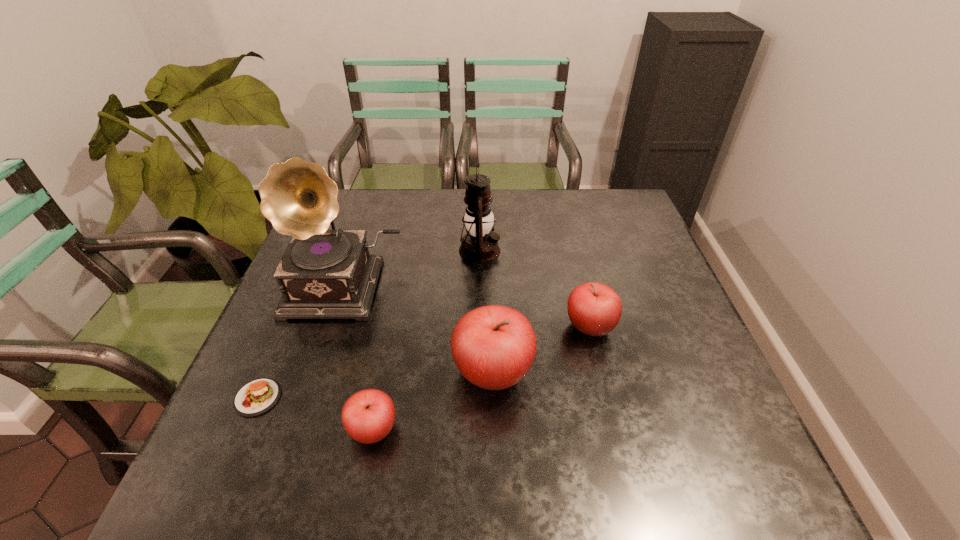
Identify the location of vacant space at the near edge. The width and height of the screenshot is (960, 540). (456, 407).

Where is `free space at the left edge of the desktop`? free space at the left edge of the desktop is located at coordinates (334, 320).

Identify the location of vacant point at the right edge. (617, 236).

This screenshot has width=960, height=540. In order to click on vacant region at the far left corner of the desktop in this screenshot , I will do `click(342, 207)`.

Where is `free point between the tallest object and the shortest apple`? free point between the tallest object and the shortest apple is located at coordinates (359, 359).

The image size is (960, 540). What are the coordinates of `free space between the shortest object and the tallest object` in the screenshot? It's located at (301, 342).

You are a GUI agent. You are given a task and a screenshot of the screen. Output one action in this format:
    pyautogui.click(x=<x>, y=<y>)
    Task: Click on the vacant area that lies between the shortest object and the rightmost apple
    The width and height of the screenshot is (960, 540).
    Given the screenshot: What is the action you would take?
    pyautogui.click(x=423, y=362)

Where is `free space between the lantern and the second shortest object`? Image resolution: width=960 pixels, height=540 pixels. free space between the lantern and the second shortest object is located at coordinates (426, 341).

Where is `vacant area that lies between the second apple from right to left and the record player`? The width and height of the screenshot is (960, 540). vacant area that lies between the second apple from right to left and the record player is located at coordinates (419, 330).

Where is `free point between the second apple from right to left and the record player`? The image size is (960, 540). free point between the second apple from right to left and the record player is located at coordinates (419, 330).